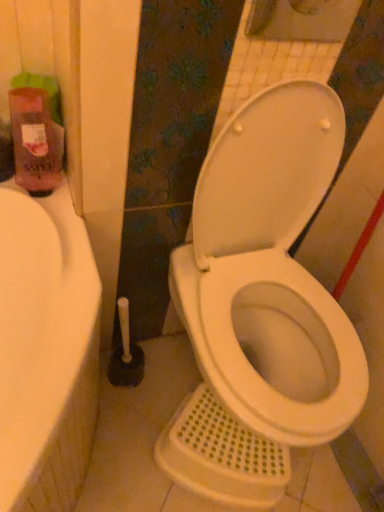
Image resolution: width=384 pixels, height=512 pixels. What do you see at coordinates (35, 136) in the screenshot?
I see `pink matte bottle at left` at bounding box center [35, 136].

This screenshot has width=384, height=512. Find the location of `pink matte bottle at left`. pink matte bottle at left is located at coordinates (35, 136).

What is the approximate height of pink matte bottle at left?

The height of pink matte bottle at left is 8.13 inches.

This screenshot has height=512, width=384. I want to click on white glossy toilet at center, so click(261, 305).

The image size is (384, 512). What do you see at coordinates (261, 305) in the screenshot? I see `white glossy toilet at center` at bounding box center [261, 305].

I want to click on pink matte bottle at left, so click(35, 136).

Can you confirm if white glossy toilet at center is positioned to the right of pink matte bottle at left?

Correct, you'll find white glossy toilet at center to the right of pink matte bottle at left.

Which object is closer to the camera taking this photo, white glossy toilet at center or pink matte bottle at left?

white glossy toilet at center is in front.

Between point (228, 464) and point (51, 150), which one is positioned behind?

Positioned behind is point (228, 464).

From the image's perspective, is white glossy toilet at center over pink matte bottle at left?

No, from the image's perspective, white glossy toilet at center is not above pink matte bottle at left.

From a real-world perspective, which is physically above, white glossy toilet at center or pink matte bottle at left?

pink matte bottle at left is physically above.

Is white glossy toilet at center wider or thinner than pink matte bottle at left?

Clearly, white glossy toilet at center has more width compared to pink matte bottle at left.

Is white glossy toilet at center shorter than pink matte bottle at left?

Incorrect, the height of white glossy toilet at center does not fall short of that of pink matte bottle at left.

Between white glossy toilet at center and pink matte bottle at left, which one has smaller size?

With smaller size is pink matte bottle at left.

Is white glossy toilet at center not within pink matte bottle at left?

That's correct, white glossy toilet at center is outside of pink matte bottle at left.

Is white glossy toilet at center next to pink matte bottle at left?

white glossy toilet at center and pink matte bottle at left are not in contact.

In the scene shown: Is white glossy toilet at center oriented towards pink matte bottle at left?

No.

How many degrees apart are the facing directions of white glossy toilet at center and pink matte bottle at left?

white glossy toilet at center and pink matte bottle at left are facing 2.03 degrees away from each other.

In order to click on toilet on the right of pink matte bottle at left in this screenshot , I will do `click(261, 305)`.

Does pink matte bottle at left appear on the left side of white glossy toilet at center?

Correct, you'll find pink matte bottle at left to the left of white glossy toilet at center.

Is pink matte bottle at left in front of or behind white glossy toilet at center in the image?

pink matte bottle at left is positioned farther from the viewer than white glossy toilet at center.

Does point (29, 159) come farther from viewer compared to point (299, 367)?

No, (29, 159) is in front of (299, 367).

In the scene shown: From the image's perspective, would you say pink matte bottle at left is shown under white glossy toilet at center?

Incorrect, from the image's perspective, pink matte bottle at left is higher than white glossy toilet at center.

From a real-world perspective, between pink matte bottle at left and white glossy toilet at center, who is vertically lower?

From a 3D spatial view, white glossy toilet at center is below.

Considering the sizes of objects pink matte bottle at left and white glossy toilet at center in the image provided, who is thinner, pink matte bottle at left or white glossy toilet at center?

With smaller width is pink matte bottle at left.

Considering the sizes of objects pink matte bottle at left and white glossy toilet at center in the image provided, who is shorter, pink matte bottle at left or white glossy toilet at center?

pink matte bottle at left is shorter.

Can you confirm if pink matte bottle at left is smaller than white glossy toilet at center?

Correct, pink matte bottle at left occupies less space than white glossy toilet at center.

Is pink matte bottle at left spatially inside white glossy toilet at center, or outside of it?

pink matte bottle at left exists outside the volume of white glossy toilet at center.

Is pink matte bottle at left beside white glossy toilet at center?

pink matte bottle at left and white glossy toilet at center are not in contact.

Is pink matte bottle at left positioned with its back to white glossy toilet at center?

No.

How many degrees apart are the facing directions of pink matte bottle at left and white glossy toilet at center?

pink matte bottle at left and white glossy toilet at center are facing 2.03 degrees away from each other.

Measure the distance from pink matte bottle at left to white glossy toilet at center.

The distance of pink matte bottle at left from white glossy toilet at center is 20.77 inches.

The width and height of the screenshot is (384, 512). In order to click on toilet in front of the pink matte bottle at left in this screenshot , I will do `click(261, 305)`.

This screenshot has width=384, height=512. In order to click on toilet lying in front of the pink matte bottle at left in this screenshot , I will do `click(261, 305)`.

Find the location of `cleaning product above the white glossy toilet at center (from a real-world perspective)`. cleaning product above the white glossy toilet at center (from a real-world perspective) is located at coordinates (35, 136).